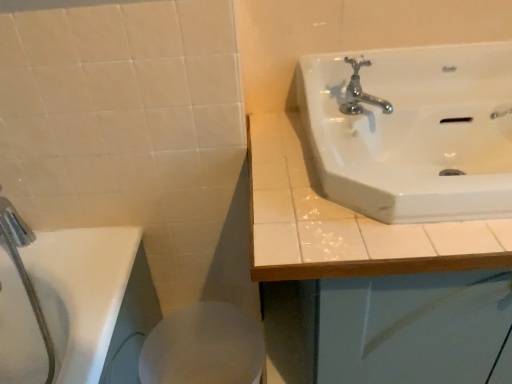
Question: Considering the relative sizes of chrome metallic faucet at upper right and white glossy bidet at lower center in the image provided, is chrome metallic faucet at upper right wider than white glossy bidet at lower center?

Choices:
 (A) no
 (B) yes

Answer: (A)

Question: Is the position of chrome metallic faucet at upper right less distant than that of white glossy bidet at lower center?

Choices:
 (A) no
 (B) yes

Answer: (B)

Question: From a real-world perspective, is chrome metallic faucet at upper right physically above white glossy bidet at lower center?

Choices:
 (A) yes
 (B) no

Answer: (A)

Question: Is chrome metallic faucet at upper right positioned far away from white glossy bidet at lower center?

Choices:
 (A) yes
 (B) no

Answer: (B)

Question: Can you confirm if chrome metallic faucet at upper right is thinner than white glossy bidet at lower center?

Choices:
 (A) yes
 (B) no

Answer: (A)

Question: Is point (484, 236) positioned closer to the camera than point (223, 357)?

Choices:
 (A) farther
 (B) closer

Answer: (B)

Question: In terms of size, does white glossy sink at upper right appear bigger or smaller than white glossy bidet at lower center?

Choices:
 (A) small
 (B) big

Answer: (B)

Question: From the image's perspective, relative to white glossy bidet at lower center, is white glossy sink at upper right above or below?

Choices:
 (A) below
 (B) above

Answer: (B)

Question: Considering the positions of white glossy sink at upper right and white glossy bidet at lower center in the image, is white glossy sink at upper right taller or shorter than white glossy bidet at lower center?

Choices:
 (A) short
 (B) tall

Answer: (B)

Question: Looking at their shapes, would you say white glossy sink at upper right is wider or thinner than white glossy sink at upper right?

Choices:
 (A) thin
 (B) wide

Answer: (A)

Question: In the image, is white glossy sink at upper right on the left side or the right side of white glossy sink at upper right?

Choices:
 (A) right
 (B) left

Answer: (B)

Question: Is white glossy sink at upper right spatially inside white glossy sink at upper right, or outside of it?

Choices:
 (A) inside
 (B) outside

Answer: (B)

Question: Considering the positions of point (415, 200) and point (463, 233), is point (415, 200) closer or farther from the camera than point (463, 233)?

Choices:
 (A) closer
 (B) farther

Answer: (A)

Question: Considering the positions of white glossy sink at upper right and white glossy sink at upper right in the image, is white glossy sink at upper right bigger or smaller than white glossy sink at upper right?

Choices:
 (A) big
 (B) small

Answer: (A)

Question: Does point (359, 231) appear closer or farther from the camera than point (345, 201)?

Choices:
 (A) closer
 (B) farther

Answer: (A)